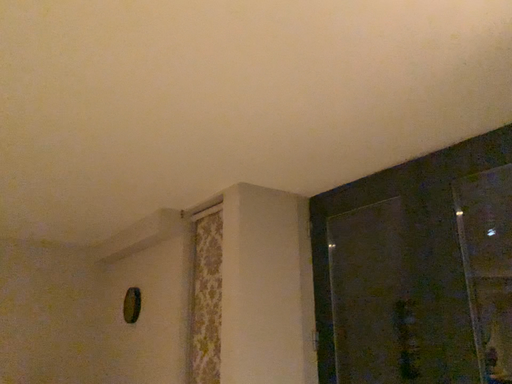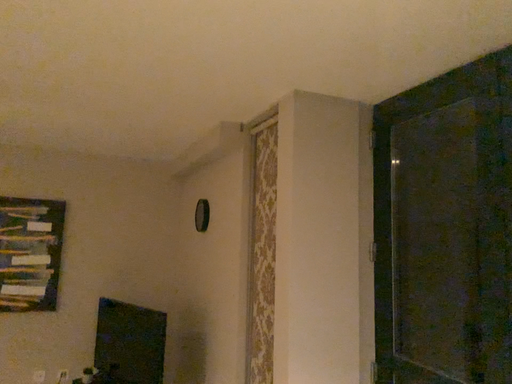
Question: Which way did the camera rotate in the video?

Choices:
 (A) rotated right
 (B) rotated left

Answer: (B)